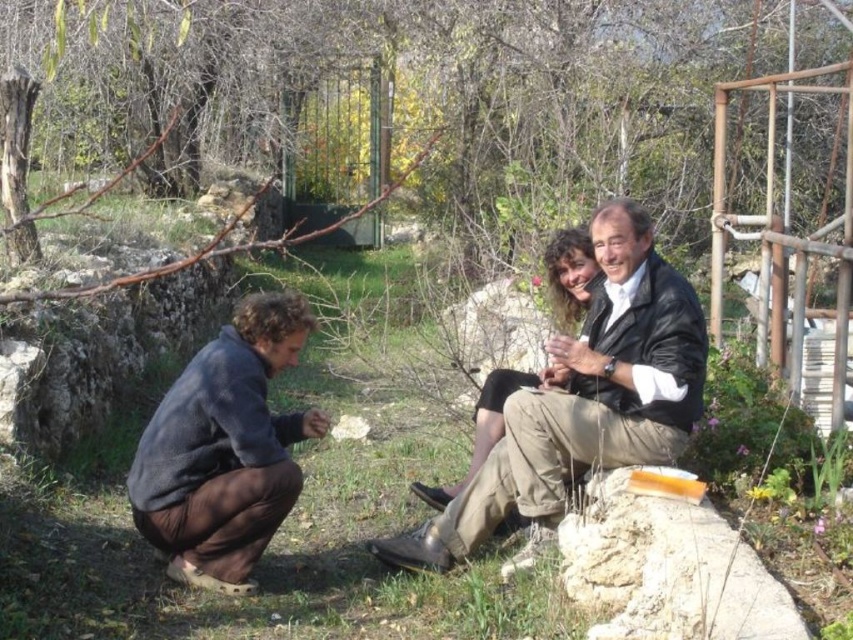
Is point (267, 312) in front of point (572, 285)?

Yes, it is.

Who is taller, dark blue fleece at lower left or matte black jacket at center?

Standing taller between the two is dark blue fleece at lower left.

Which is in front, point (183, 474) or point (560, 268)?

Positioned in front is point (183, 474).

The image size is (853, 640). Find the location of `dark blue fleece at lower left`. dark blue fleece at lower left is located at coordinates (224, 449).

Based on the photo, between green grass at center and dark blue fleece at lower left, which one is positioned lower?

green grass at center is lower down.

Identify the location of green grass at center. The height and width of the screenshot is (640, 853). tap(294, 506).

Locate an element on the screen. green grass at center is located at coordinates (294, 506).

In order to click on green grass at center in this screenshot , I will do `click(294, 506)`.

Does green grass at center appear on the left side of matte black jacket at center?

Correct, you'll find green grass at center to the left of matte black jacket at center.

Image resolution: width=853 pixels, height=640 pixels. I want to click on green grass at center, so click(294, 506).

Find the location of `green grass at center`. green grass at center is located at coordinates (294, 506).